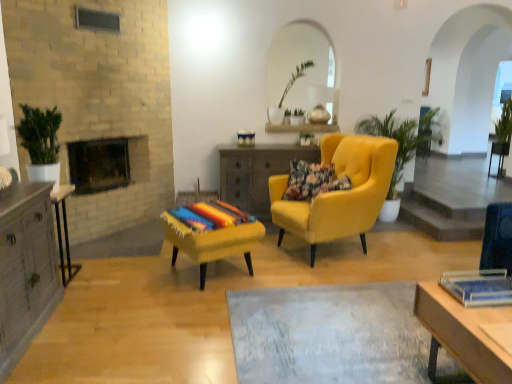
Describe the element at coordinates (102, 164) in the screenshot. The image size is (512, 384). I see `brick fireplace at center-left` at that location.

Image resolution: width=512 pixels, height=384 pixels. Describe the element at coordinates (339, 192) in the screenshot. I see `yellow fabric armchair at center` at that location.

Find the location of `wooden desk at lower right`. wooden desk at lower right is located at coordinates (463, 333).

At what (x,y) coordinates should I click in order to perform the action: click on green glossy plant at left, which is counted as the third houseplant, starting from the right. Please return your answer as a coordinate pair (x, y). Looking at the image, I should click on (41, 142).

Measure the distance between point (24, 113) and camera.

A: A distance of 10.17 feet exists between point (24, 113) and camera.

Locate an element on the screen. The width and height of the screenshot is (512, 384). brick fireplace at center-left is located at coordinates (102, 164).

Which is correct: wooden desk at lower right is inside wooden cabinet at left, the 2th table when ordered from back to front, or outside of it?

wooden desk at lower right is not enclosed by wooden cabinet at left, the 2th table when ordered from back to front.

How different are the orientations of wooden desk at lower right and wooden cabinet at left, which is counted as the 1th table, starting from the left, in degrees?

The angle between the facing direction of wooden desk at lower right and the facing direction of wooden cabinet at left, which is counted as the 1th table, starting from the left, is 178 degrees.

Considering the sizes of objects wooden desk at lower right and wooden cabinet at left, the first table positioned from the front, in the image provided, who is taller, wooden desk at lower right or wooden cabinet at left, the first table positioned from the front,?

Standing taller between the two is wooden cabinet at left, the first table positioned from the front.

Is point (448, 316) positioned before point (58, 226)?

That is True.

How many degrees apart are the facing directions of green leafy plant at center, which is the second houseplant in front-to-back order, and velvet yellow stool at center?

There is a 27.7-degree angle between the facing directions of green leafy plant at center, which is the second houseplant in front-to-back order, and velvet yellow stool at center.

From a real-world perspective, which is physically below, green leafy plant at center, which is the third houseplant from left to right, or velvet yellow stool at center?

In real-world perspective, velvet yellow stool at center is lower.

Which object is closer to the camera, green leafy plant at center, which appears as the first houseplant when viewed from the right, or velvet yellow stool at center?

velvet yellow stool at center.

Is green leafy plant at center, acting as the 2th houseplant starting from the back, surrounding velvet yellow stool at center?

No, velvet yellow stool at center is not surrounded by green leafy plant at center, acting as the 2th houseplant starting from the back.

Looking at this image, is green glossy plant at left, which is the 1th houseplant in front-to-back order, oriented away from floral fabric pillow at center?

No, floral fabric pillow at center is not at the back of green glossy plant at left, which is the 1th houseplant in front-to-back order.

Does point (28, 133) appear closer or farther from the camera than point (309, 190)?

Point (28, 133).

Does green glossy plant at left, which is the 1th houseplant from left to right, have a greater height compared to floral fabric pillow at center?

Indeed, green glossy plant at left, which is the 1th houseplant from left to right, has a greater height compared to floral fabric pillow at center.

From the picture: How many degrees apart are the facing directions of green glossy plant at left, which is the 1th houseplant from left to right, and floral fabric pillow at center?

The angle between the facing direction of green glossy plant at left, which is the 1th houseplant from left to right, and the facing direction of floral fabric pillow at center is 103 degrees.

Is wooden cabinet at left, the 2th table when ordered from back to front, taller than brick fireplace at center-left?

Indeed, wooden cabinet at left, the 2th table when ordered from back to front, has a greater height compared to brick fireplace at center-left.

From a real-world perspective, is wooden cabinet at left, the first table positioned from the front, physically located above or below brick fireplace at center-left?

Result: From a real-world perspective, wooden cabinet at left, the first table positioned from the front, is physically below brick fireplace at center-left.

Could you tell me if wooden cabinet at left, which is counted as the 1th table, starting from the left, is facing brick fireplace at center-left?

No, wooden cabinet at left, which is counted as the 1th table, starting from the left, is not oriented towards brick fireplace at center-left.

In the image, is wooden cabinet at left, the 2th table when ordered from back to front, on the left side or the right side of brick fireplace at center-left?

Based on their positions, wooden cabinet at left, the 2th table when ordered from back to front, is located to the right of brick fireplace at center-left.

Looking at this image, from the image's perspective, is green leafy plant at upper right, the first plant from the back, positioned above or below green glossy plant at left, which is the 1th houseplant from left to right?

green leafy plant at upper right, the first plant from the back, is above green glossy plant at left, which is the 1th houseplant from left to right.

Is there a large distance between green leafy plant at upper right, the first plant from the back, and green glossy plant at left, which is counted as the third houseplant, starting from the right?

green leafy plant at upper right, the first plant from the back, is far away from green glossy plant at left, which is counted as the third houseplant, starting from the right.

Considering the relative sizes of green leafy plant at upper right, which is counted as the second plant, starting from the bottom, and green glossy plant at left, which is the 1th houseplant from left to right, in the image provided, is green leafy plant at upper right, which is counted as the second plant, starting from the bottom, thinner than green glossy plant at left, which is the 1th houseplant from left to right,?

In fact, green leafy plant at upper right, which is counted as the second plant, starting from the bottom, might be wider than green glossy plant at left, which is the 1th houseplant from left to right.

What's the angular difference between wooden side table at center, acting as the second table starting from the left, and green leafy plant at upper right, positioned as the 1th plant in top-to-bottom order,'s facing directions?

The angle between the facing direction of wooden side table at center, acting as the second table starting from the left, and the facing direction of green leafy plant at upper right, positioned as the 1th plant in top-to-bottom order, is 89.7 degrees.

Considering the relative sizes of wooden side table at center, which is the 2th table from front to back, and green leafy plant at upper right, which is counted as the second plant, starting from the bottom, in the image provided, is wooden side table at center, which is the 2th table from front to back, shorter than green leafy plant at upper right, which is counted as the second plant, starting from the bottom,?

Incorrect, the height of wooden side table at center, which is the 2th table from front to back, does not fall short of that of green leafy plant at upper right, which is counted as the second plant, starting from the bottom.

Between wooden side table at center, placed as the first table when sorted from right to left, and green leafy plant at upper right, positioned as the 1th plant in top-to-bottom order, which one has smaller width?

Thinner between the two is green leafy plant at upper right, positioned as the 1th plant in top-to-bottom order.

Is wooden side table at center, the 1th table when ordered from back to front, looking in the opposite direction of green leafy plant at upper right, which is the first plant in right-to-left order?

No, wooden side table at center, the 1th table when ordered from back to front, is not facing away from green leafy plant at upper right, which is the first plant in right-to-left order.

Based on the photo, from the image's perspective, which one is positioned lower, wooden cabinet at left, the 2th table when ordered from back to front, or wooden desk at lower right?

wooden desk at lower right appears lower in the image.

Does wooden cabinet at left, the second table in the right-to-left sequence, turn towards wooden desk at lower right?

No, wooden cabinet at left, the second table in the right-to-left sequence, does not turn towards wooden desk at lower right.

From the image's perspective, which table is the 1st one above the wooden desk at lower right? Please provide its 2D coordinates.

[(64, 231)]

Find the location of a particular element. The height and width of the screenshot is (384, 512). desk below the wooden cabinet at left, the second table in the right-to-left sequence (from the image's perspective) is located at coordinates (463, 333).

From a real-world perspective, count 1st houseplants upward from the velvet yellow stool at center and point to it. Please provide its 2D coordinates.

[(399, 148)]

Based on their spatial positions, is floral fabric pillow at center or wooden desk at lower right further from green glossy plant at left, the 3th houseplant from the back?

wooden desk at lower right is positioned further to the anchor green glossy plant at left, the 3th houseplant from the back.

Which object lies nearer to the anchor point yellow fabric armchair at center, green glossy plant at left, which is the 1th houseplant in front-to-back order, or green leafy plant at center, which is the third houseplant from left to right?

Based on the image, green leafy plant at center, which is the third houseplant from left to right, appears to be nearer to yellow fabric armchair at center.

Looking at the image, which one is located further to wooden cabinet at left, green leafy plant at upper right, which is counted as the second plant, starting from the bottom, or velvet yellow stool at center?

green leafy plant at upper right, which is counted as the second plant, starting from the bottom, lies further to wooden cabinet at left than the other object.

Which object lies nearer to the anchor point wooden cabinet at left, yellow fabric armchair at center or wooden side table at center, placed as the first table when sorted from right to left?

yellow fabric armchair at center.

Estimate the real-world distances between objects in this image. Which object is further from green glossy plant at left, the 3th houseplant from the back, velvet yellow stool at center or brick fireplace at center-left?

Among the two, velvet yellow stool at center is located further to green glossy plant at left, the 3th houseplant from the back.

From the image, which object appears to be farther from velvet yellow stool at center, wooden cabinet at left, which is counted as the 1th table, starting from the left, or green leafy plant at center, which is the third houseplant from left to right?

Based on the image, green leafy plant at center, which is the third houseplant from left to right, appears to be further to velvet yellow stool at center.

From the picture: Estimate the real-world distances between objects in this image. Which object is further from floral fabric pillow at center, brick fireplace at center-left or wooden side table at center, which is the 2th table from front to back?

The object further to floral fabric pillow at center is brick fireplace at center-left.

Considering their positions, is green leafy plant at center, which is the 1th plant from left to right, positioned further to green leafy plant at center, which appears as the first houseplant when viewed from the right, than green leafy plant at upper center, acting as the third houseplant starting from the front?

The object further to green leafy plant at center, which appears as the first houseplant when viewed from the right, is green leafy plant at upper center, acting as the third houseplant starting from the front.

Identify the location of plant between floral fabric pillow at center and green leafy plant at center, acting as the 2th houseplant starting from the back, from left to right. (306, 137).

You are a GUI agent. You are given a task and a screenshot of the screen. Output one action in this format:
    pyautogui.click(x=<x>, y=<y>)
    Task: Click on the chair between wooden desk at lower right and green leafy plant at center, which is the second houseplant in front-to-back order, in the front-back direction
    Image resolution: width=512 pixels, height=384 pixels.
    Given the screenshot: What is the action you would take?
    pyautogui.click(x=339, y=192)

Where is `table situated between wooden cabinet at left and green leafy plant at upper right, which is the second plant in left-to-right order, from left to right`? The image size is (512, 384). table situated between wooden cabinet at left and green leafy plant at upper right, which is the second plant in left-to-right order, from left to right is located at coordinates (257, 173).

The height and width of the screenshot is (384, 512). In order to click on pillow between velvet yellow stool at center and green leafy plant at center, which is the second houseplant in front-to-back order, in the horizontal direction in this screenshot , I will do `click(308, 180)`.